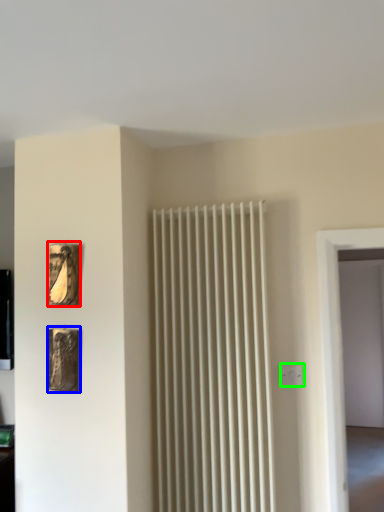
Question: Considering the real-world distances, which object is farthest from picture frame (highlighted by a red box)? picture frame (highlighted by a blue box) or electric outlet (highlighted by a green box)?

Choices:
 (A) picture frame
 (B) electric outlet

Answer: (B)